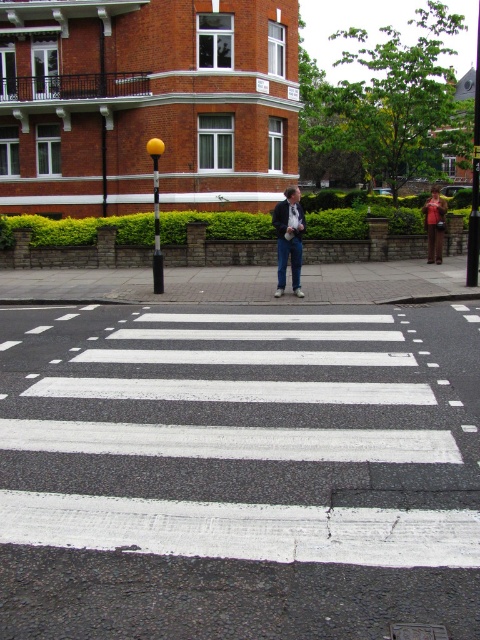
Can you confirm if dark blue jeans at center is smaller than brown leather jacket at upper right?

No.

Is point (295, 262) farther from viewer compared to point (432, 240)?

No.

The width and height of the screenshot is (480, 640). Find the location of `dark blue jeans at center`. dark blue jeans at center is located at coordinates (288, 237).